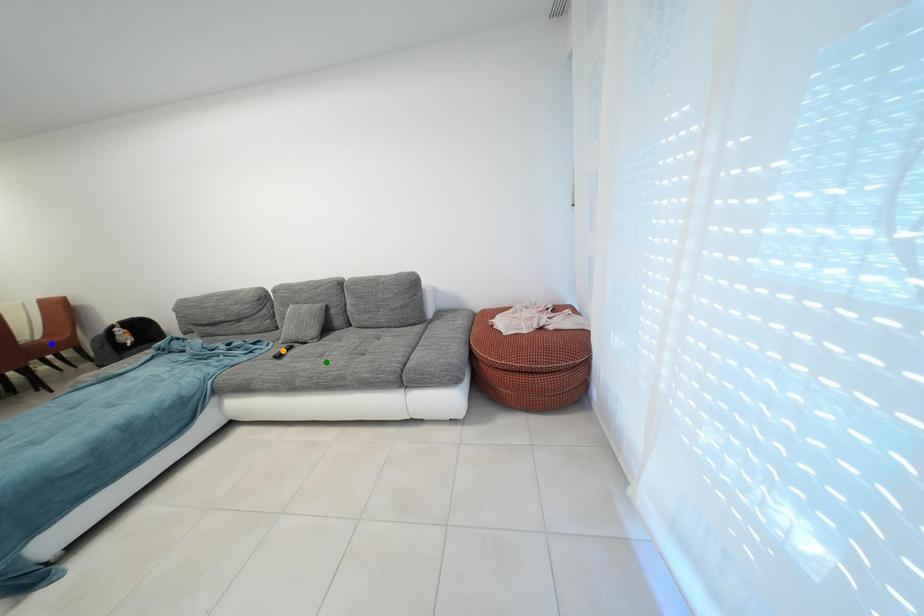
Order these from farthest to nearest:
orange point | green point | blue point

orange point < blue point < green point